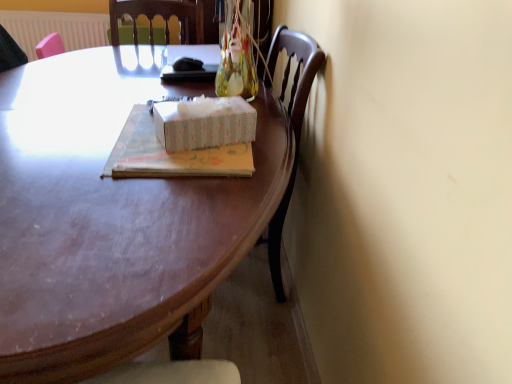
Where is `free space in front of white paper tissue box at center`? free space in front of white paper tissue box at center is located at coordinates (197, 185).